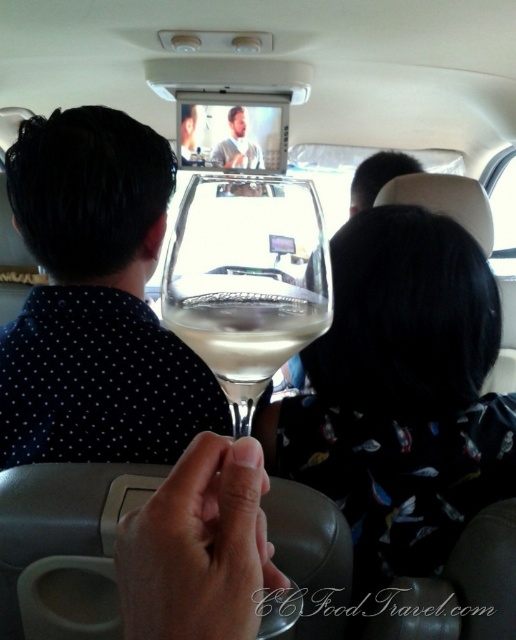
Question: Which point is closer to the camera?

Choices:
 (A) smooth skin face at center
 (B) black dotted shirt at upper left
 (C) silky black hair at center
 (D) clear glass wine glass at center

Answer: (D)

Question: Is black dotted shirt at upper left positioned behind clear glass wine glass at center?

Choices:
 (A) no
 (B) yes

Answer: (B)

Question: Does clear glass wine glass at center appear over smooth skin face at center?

Choices:
 (A) no
 (B) yes

Answer: (A)

Question: Which point appears closest to the camera in this image?

Choices:
 (A) (153, 353)
 (B) (266, 202)
 (C) (250, 161)

Answer: (B)

Question: Which object appears closest to the camera in this image?

Choices:
 (A) black dotted shirt at upper left
 (B) silky black hair at center
 (C) smooth skin face at center

Answer: (B)

Question: Is black dotted shirt at upper left to the right of clear glass wine glass at center from the viewer's perspective?

Choices:
 (A) yes
 (B) no

Answer: (B)